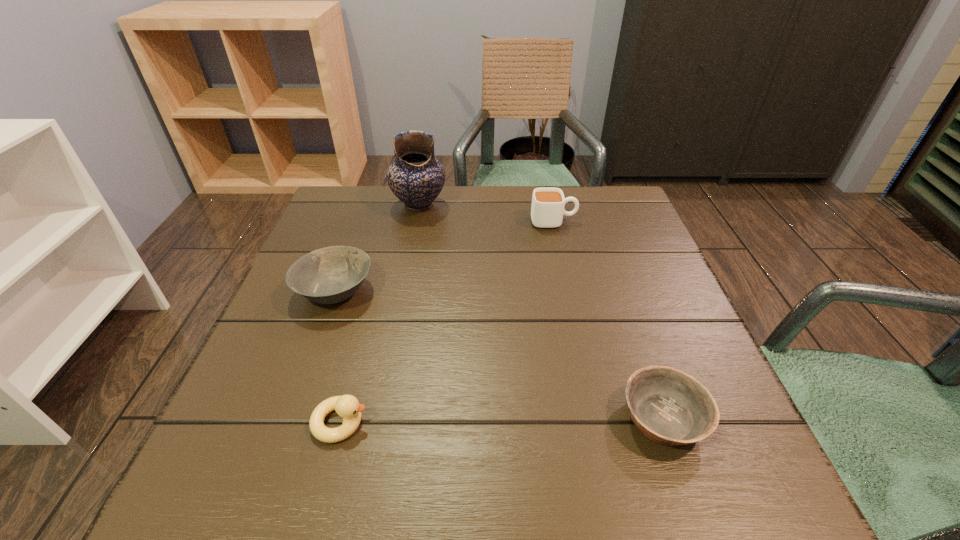
Where is `vacant space positioned at the beak of the duckling`? Image resolution: width=960 pixels, height=540 pixels. vacant space positioned at the beak of the duckling is located at coordinates (424, 422).

Image resolution: width=960 pixels, height=540 pixels. In order to click on vacant space located 0.370m on the left of the shorter bowl in this screenshot , I will do `click(395, 418)`.

Where is `pottery positioned at the far edge`? This screenshot has width=960, height=540. pottery positioned at the far edge is located at coordinates (415, 177).

The width and height of the screenshot is (960, 540). I want to click on cup that is at the far edge, so click(x=547, y=209).

Locate an element on the screen. This screenshot has height=540, width=960. object at the near edge is located at coordinates (669, 407).

Identify the location of bowl positioned at the left edge. This screenshot has height=540, width=960. (330, 275).

At what (x,y) coordinates should I click in order to perform the action: click on duckling that is at the left edge. Please return your answer as a coordinate pair (x, y). The width and height of the screenshot is (960, 540). Looking at the image, I should click on (347, 406).

The image size is (960, 540). Identify the location of object that is at the right edge. (669, 407).

I want to click on object that is at the near right corner, so click(669, 407).

Find the location of a particular element. The image size is (960, 540). vacant space at the far edge of the desktop is located at coordinates (571, 222).